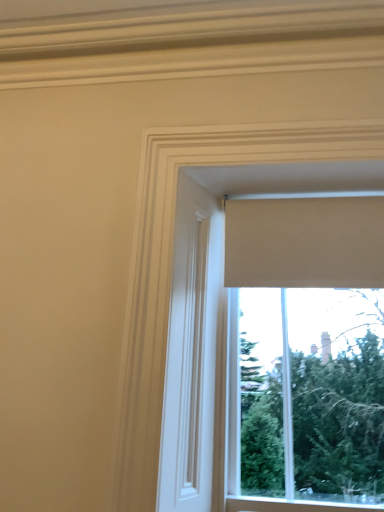
Question: Is beige fabric curtain at upper center situated inside beige fabric window at upper center or outside?

Choices:
 (A) outside
 (B) inside

Answer: (A)

Question: In the image, is beige fabric curtain at upper center positioned in front of or behind beige fabric window at upper center?

Choices:
 (A) behind
 (B) front

Answer: (A)

Question: Is point (321, 218) closer or farther from the camera than point (175, 269)?

Choices:
 (A) closer
 (B) farther

Answer: (B)

Question: Considering their positions, is beige fabric window at upper center located in front of or behind beige fabric curtain at upper center?

Choices:
 (A) front
 (B) behind

Answer: (A)

Question: From the image's perspective, is beige fabric window at upper center located above or below beige fabric curtain at upper center?

Choices:
 (A) below
 (B) above

Answer: (A)

Question: Looking at their shapes, would you say beige fabric window at upper center is wider or thinner than beige fabric curtain at upper center?

Choices:
 (A) thin
 (B) wide

Answer: (B)

Question: Is beige fabric window at upper center taller or shorter than beige fabric curtain at upper center?

Choices:
 (A) tall
 (B) short

Answer: (A)